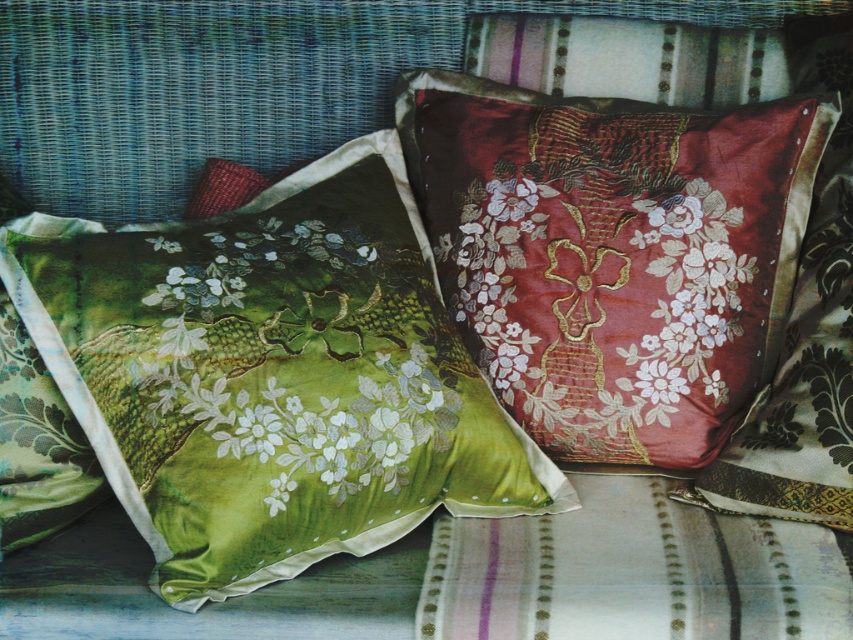
You are arranging two cushions on a shelf. The velvet floral cushion at center and the silky red floral cushion at center. If you want to place them vertically, which cushion should you put on top to match the original arrangement?

The velvet floral cushion at center should be placed on top of the silky red floral cushion at center to maintain the original arrangement where the velvet floral cushion at center is above the silky red floral cushion at center.

You are trying to place a new decorative pillow between the velvet floral cushion at center and the silky red floral cushion at center. The new pillow is 2 centimeters thick. Will there be enough space between them to fit the new pillow?

The distance between the velvet floral cushion at center and the silky red floral cushion at center is 1.99 centimeters. Since the new pillow is 2 centimeters thick, it will not fit as the space is slightly smaller than the pillow.

Where is the velvet floral cushion at center located in the image?

The velvet floral cushion at center is located at point [613,256].